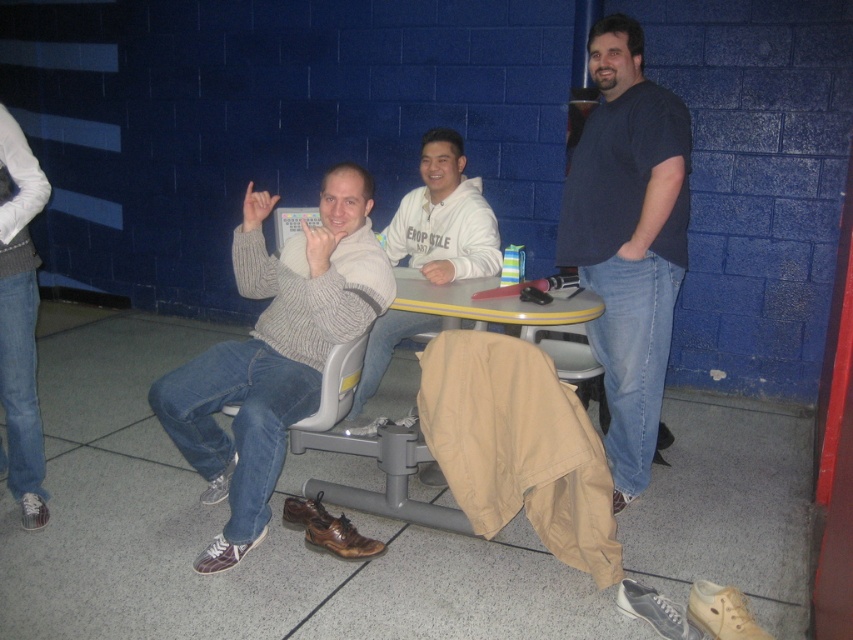
Question: Which of the following is the farthest from the observer?

Choices:
 (A) (653, 109)
 (B) (469, 268)

Answer: (B)

Question: Is the position of dark blue t-shirt at right more distant than that of white knit sweater at center?

Choices:
 (A) no
 (B) yes

Answer: (A)

Question: Is the position of white knit sweater at center more distant than that of yellow plastic table at center?

Choices:
 (A) yes
 (B) no

Answer: (A)

Question: Which point appears closest to the camera in this image?

Choices:
 (A) (297, 253)
 (B) (492, 301)
 (C) (648, 381)

Answer: (B)

Question: Is dark blue t-shirt at right positioned before yellow plastic table at center?

Choices:
 (A) no
 (B) yes

Answer: (B)

Question: Among these points, which one is nearest to the camera?

Choices:
 (A) (427, 216)
 (B) (247, 461)
 (C) (467, 296)
 (D) (595, 36)

Answer: (B)